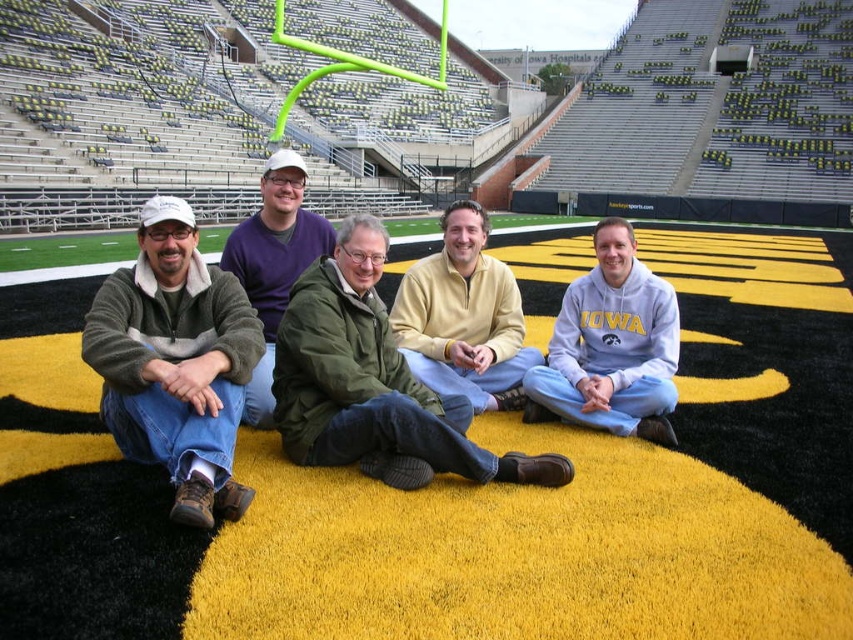
Who is positioned more to the left, light yellow sweater at center or purple fleece sweater at center?

purple fleece sweater at center

What are the coordinates of `light yellow sweater at center` in the screenshot? It's located at pos(463,317).

Image resolution: width=853 pixels, height=640 pixels. Identify the location of light yellow sweater at center. click(x=463, y=317).

Where is `gray-green sweater at left`? The image size is (853, 640). gray-green sweater at left is located at coordinates (175, 362).

Between gray-green sweater at left and purple fleece sweater at center, which one is positioned higher?

Positioned higher is purple fleece sweater at center.

Where is `gray-green sweater at left`? The image size is (853, 640). gray-green sweater at left is located at coordinates (175, 362).

Between point (305, 387) and point (674, 369), which one is positioned behind?

Positioned behind is point (674, 369).

Looking at this image, between green matte jacket at center and light blue sweatshirt at center, which one has more height?

green matte jacket at center is taller.

Where is `green matte jacket at center`? green matte jacket at center is located at coordinates (373, 384).

Identify the location of green matte jacket at center. (373, 384).